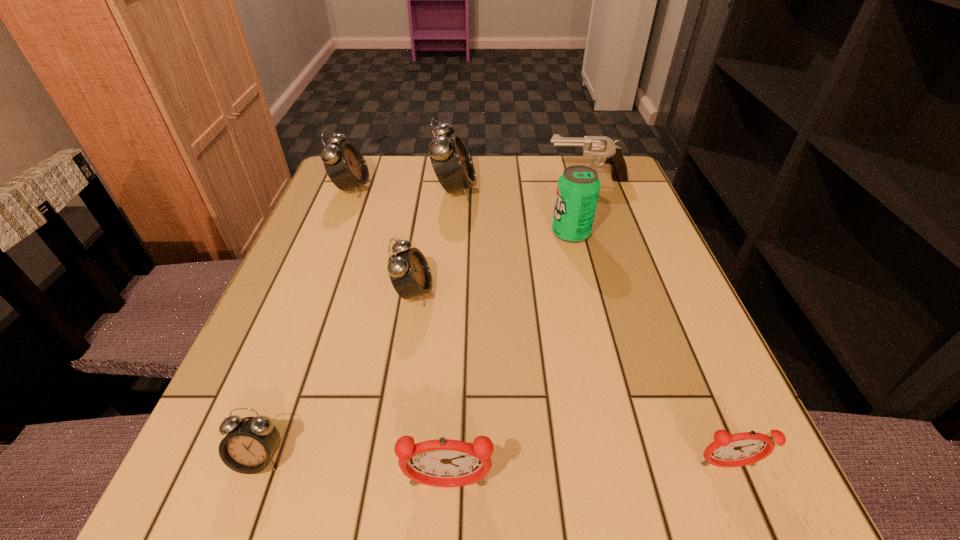
The height and width of the screenshot is (540, 960). I want to click on the smaller reddish-pink alarm clock, so point(740,449).

At what (x,y) coordinates should I click in order to perform the action: click on the nearest white alarm clock. Please return your answer as a coordinate pair (x, y). Looking at the image, I should click on (250, 443).

Where is `vacant space situated on the face of the tallest object`? The image size is (960, 540). vacant space situated on the face of the tallest object is located at coordinates (548, 190).

This screenshot has width=960, height=540. Find the location of `free location located 0.150m on the face of the third smallest white alarm clock`. free location located 0.150m on the face of the third smallest white alarm clock is located at coordinates (429, 188).

At what (x,y) coordinates should I click in order to perform the action: click on vacant space located on the front-facing side of the fourth farthest object. Please return your answer as a coordinate pair (x, y). This screenshot has width=960, height=540. Looking at the image, I should click on (389, 233).

This screenshot has height=540, width=960. Find the location of `vacant space situated 0.140m on the front-facing side of the fourth farthest object`. vacant space situated 0.140m on the front-facing side of the fourth farthest object is located at coordinates (488, 233).

Locate an element on the screen. Image resolution: width=960 pixels, height=540 pixels. free spot located on the front-facing side of the fourth farthest object is located at coordinates (488, 233).

The image size is (960, 540). In order to click on vacant space located 0.060m at the muzzle of the gun in this screenshot , I will do `click(524, 179)`.

Identify the location of vacant position located at the muzzle of the gun. (516, 179).

Locate an element on the screen. This screenshot has height=540, width=960. blank area located 0.070m at the muzzle of the gun is located at coordinates (520, 179).